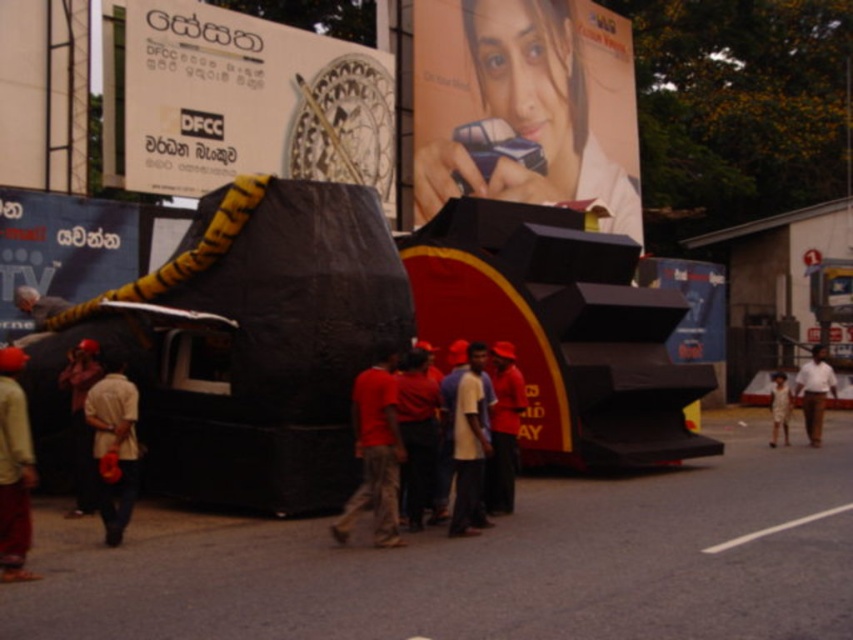
You are an event planner trying to place a new decorative banner between the blue glossy sign at center and the white cotton shirt at center. Since the banner requires at least 1.2 meters of space, can you fit it between them based on their widths?

The blue glossy sign at center has a width less than the white cotton shirt at center. However, without knowing the exact widths of both objects, it is impossible to determine if the combined space between them can accommodate a 1.2 meter banner. Additional measurements are needed.

You are standing at the center of the image and looking towards the large black and red structure. Which direction should you turn to face the matte black billboard at upper left indicated by point [250,102]?

The point [250,102] indicates the matte black billboard at upper left, so you should turn to your left to face the matte black billboard at upper left.